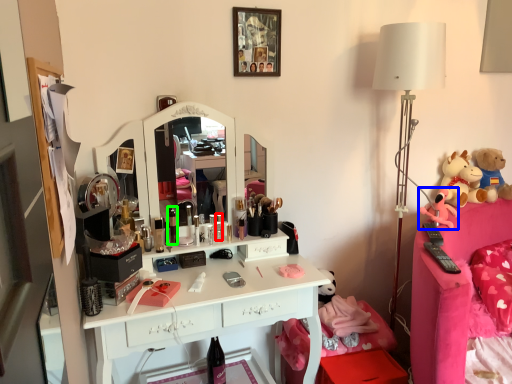
Question: Which is nearer to the toiletry (highlighted by a red box)? toy (highlighted by a blue box) or toiletry (highlighted by a green box).

Choices:
 (A) toy
 (B) toiletry

Answer: (B)